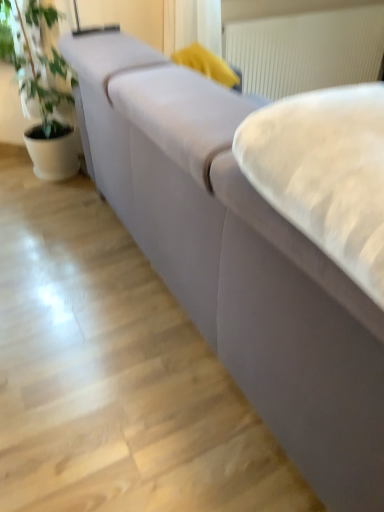
Question: From the image's perspective, is white soft cushion at center on top of white textured radiator at upper center?

Choices:
 (A) no
 (B) yes

Answer: (A)

Question: Is the position of white soft cushion at center less distant than that of white textured radiator at upper center?

Choices:
 (A) no
 (B) yes

Answer: (B)

Question: Is white soft cushion at center completely or partially outside of white textured radiator at upper center?

Choices:
 (A) no
 (B) yes

Answer: (B)

Question: Is white soft cushion at center wider than white textured radiator at upper center?

Choices:
 (A) yes
 (B) no

Answer: (A)

Question: Considering the relative sizes of white soft cushion at center and white textured radiator at upper center in the image provided, is white soft cushion at center taller than white textured radiator at upper center?

Choices:
 (A) no
 (B) yes

Answer: (A)

Question: From a real-world perspective, is white soft cushion at center below white textured radiator at upper center?

Choices:
 (A) no
 (B) yes

Answer: (A)

Question: Can you confirm if white textured radiator at upper center is bigger than white soft cushion at center?

Choices:
 (A) no
 (B) yes

Answer: (B)

Question: From a real-world perspective, is white textured radiator at upper center on white soft cushion at center?

Choices:
 (A) yes
 (B) no

Answer: (B)

Question: Is white textured radiator at upper center touching white soft cushion at center?

Choices:
 (A) yes
 (B) no

Answer: (B)

Question: Is white textured radiator at upper center closer to the viewer compared to white soft cushion at center?

Choices:
 (A) yes
 (B) no

Answer: (B)

Question: Is white textured radiator at upper center further to camera compared to white soft cushion at center?

Choices:
 (A) no
 (B) yes

Answer: (B)

Question: Is white textured radiator at upper center to the left of white soft cushion at center from the viewer's perspective?

Choices:
 (A) no
 (B) yes

Answer: (A)

Question: Based on their sizes in the image, would you say white textured radiator at upper center is bigger or smaller than white soft cushion at center?

Choices:
 (A) big
 (B) small

Answer: (A)